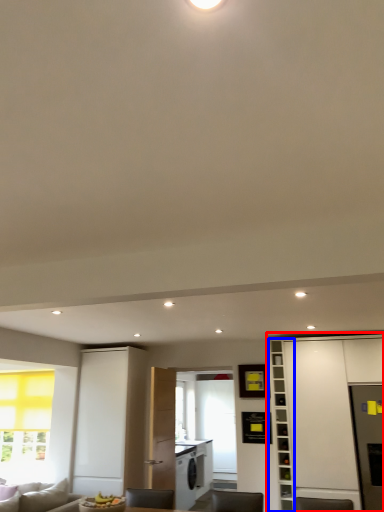
Question: Which object is closer to the camera taking this photo, cabinetry (highlighted by a red box) or bookshelf (highlighted by a blue box)?

Choices:
 (A) cabinetry
 (B) bookshelf

Answer: (A)